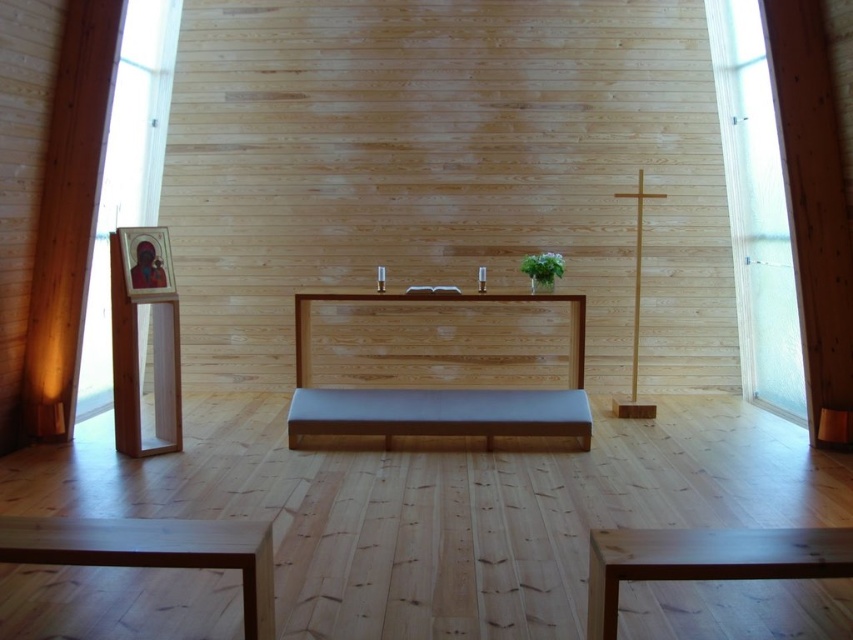
Question: Which object is farther from the camera taking this photo?

Choices:
 (A) natural wood stool at lower center
 (B) clear glass window at left
 (C) natural wood pulpit at center
 (D) frosted glass window at right

Answer: (D)

Question: Where is natural wood stool at lower center located in relation to light brown wooden stool at lower left in the image?

Choices:
 (A) left
 (B) right

Answer: (B)

Question: Where is frosted glass window at right located in relation to natural wood stool at lower center in the image?

Choices:
 (A) right
 (B) left

Answer: (A)

Question: Can you confirm if clear glass window at left is bigger than natural wood pulpit at center?

Choices:
 (A) no
 (B) yes

Answer: (B)

Question: Which point is farther to the camera?

Choices:
 (A) natural wood stool at lower center
 (B) smooth brown bench at center

Answer: (B)

Question: Among these objects, which one is nearest to the camera?

Choices:
 (A) clear glass window at left
 (B) natural wood pulpit at center

Answer: (B)